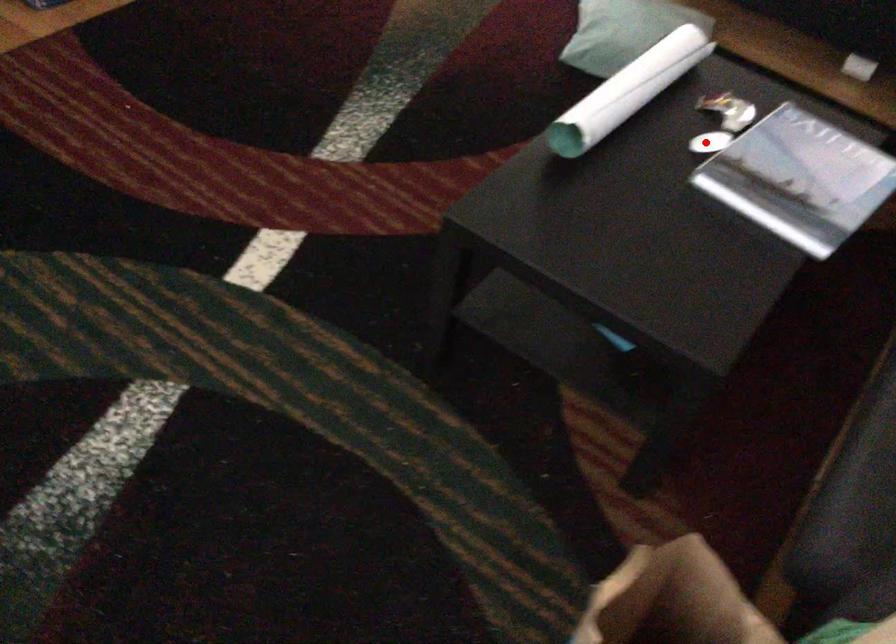
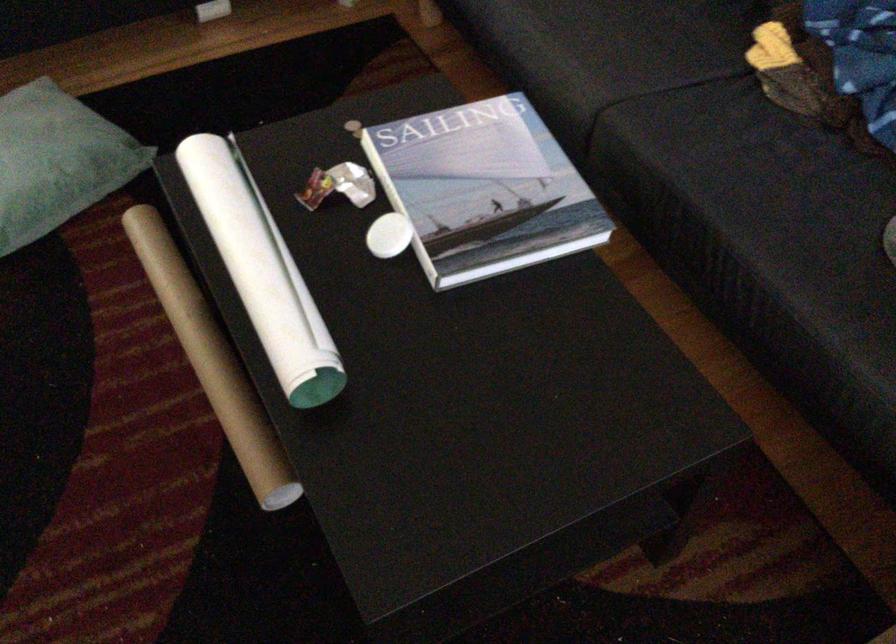
In the second image, find the point that corresponds to the highlighted location in the first image.

(389, 236)